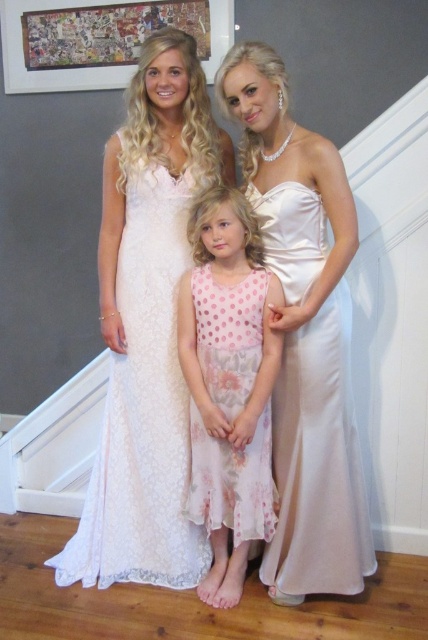
Question: Does satin dress at center appear on the left side of pink floral dress at center?

Choices:
 (A) no
 (B) yes

Answer: (A)

Question: Does lace fabric dress at center come in front of satin dress at center?

Choices:
 (A) no
 (B) yes

Answer: (A)

Question: Which of the following is the closest to the observer?

Choices:
 (A) pink floral dress at center
 (B) satin dress at center
 (C) lace fabric dress at center

Answer: (B)

Question: Does satin dress at center appear under pink floral dress at center?

Choices:
 (A) yes
 (B) no

Answer: (B)

Question: Among these points, which one is farthest from the camera?

Choices:
 (A) (219, 208)
 (B) (294, 426)
 (C) (151, 164)

Answer: (C)

Question: Which object appears closest to the camera in this image?

Choices:
 (A) lace fabric dress at center
 (B) pink floral dress at center
 (C) satin dress at center

Answer: (C)